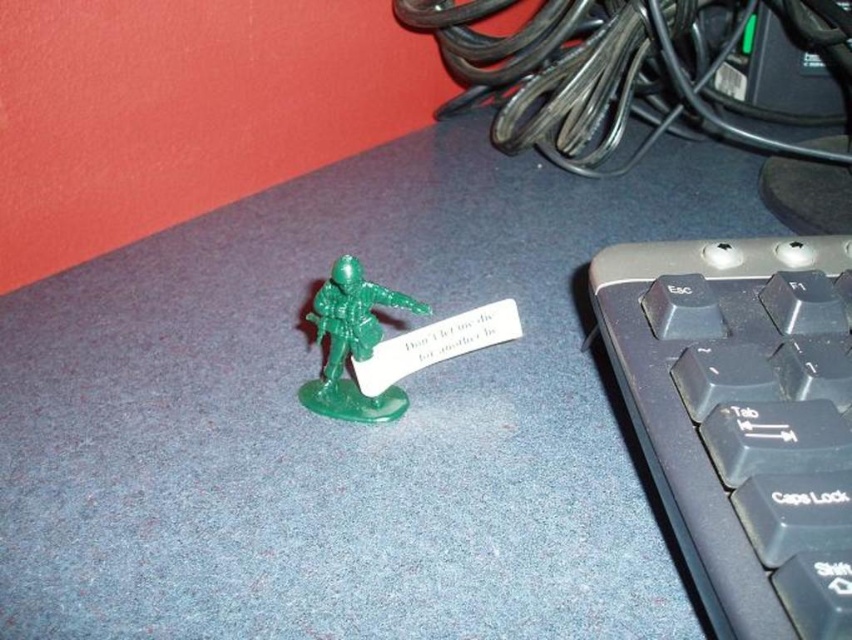
Which is below, black plastic keyboard at right or green plastic toy soldier at center?

black plastic keyboard at right is below.

Which is more to the left, black plastic keyboard at right or green plastic toy soldier at center?

From the viewer's perspective, green plastic toy soldier at center appears more on the left side.

Measure the distance between point (x=722, y=595) and camera.

19.06 inches

Where is `black plastic keyboard at right`? The image size is (852, 640). black plastic keyboard at right is located at coordinates (743, 417).